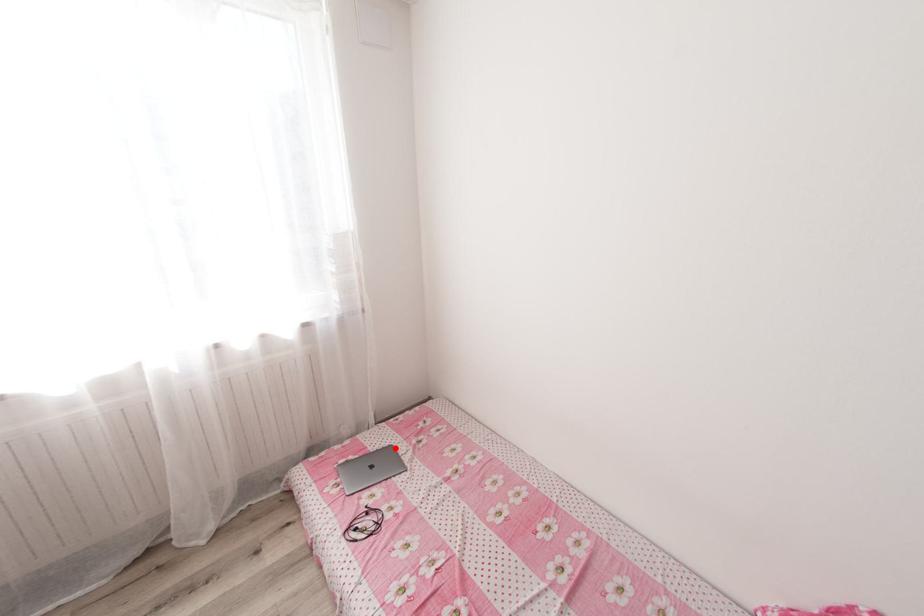
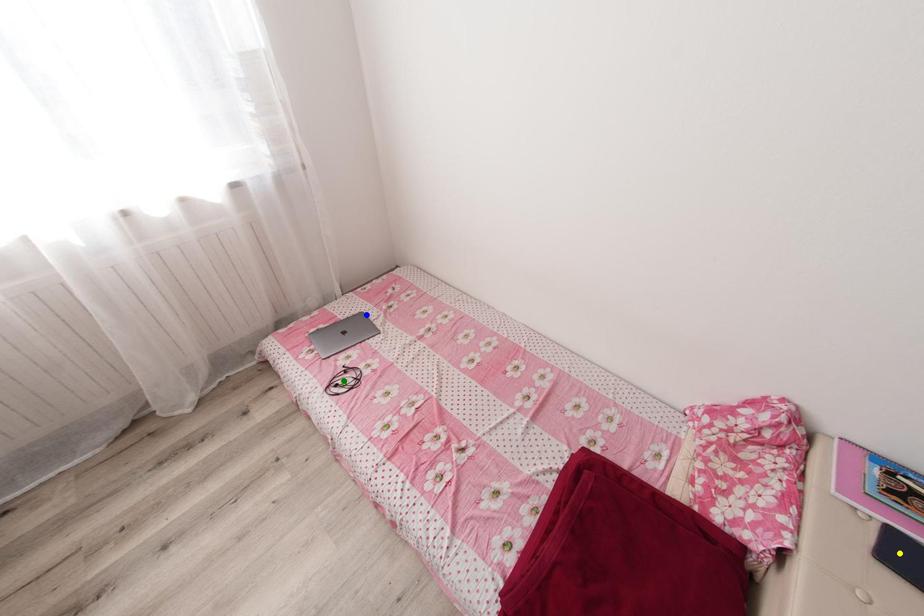
Question: I am providing you with two images of the same scene from different viewpoints. A red point is marked on the first image. You are given multiple points on the second image. In image 2, which mark is for the same physical point as the one in image 1?

Choices:
 (A) green point
 (B) yellow point
 (C) blue point

Answer: (C)